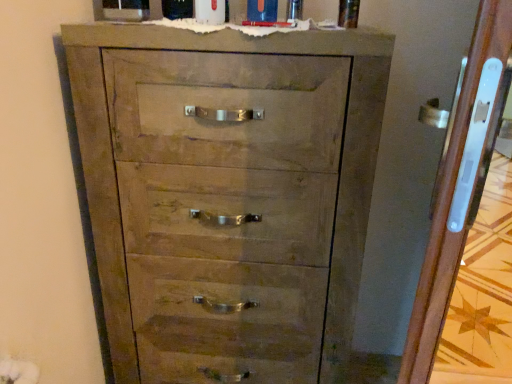
This screenshot has height=384, width=512. Describe the element at coordinates (228, 193) in the screenshot. I see `wooden chest of drawers at center` at that location.

Identify the location of wooden chest of drawers at center. (228, 193).

You are a GUI agent. You are given a task and a screenshot of the screen. Output one action in this format:
    pyautogui.click(x=<x>, y=<y>)
    Task: Click on the wooden chest of drawers at center
    
    Given the screenshot: What is the action you would take?
    pyautogui.click(x=228, y=193)